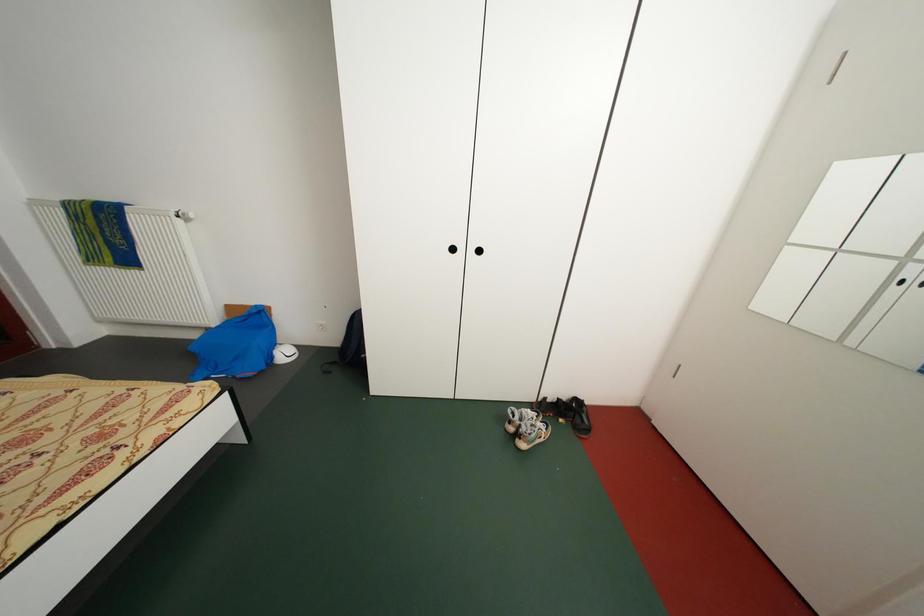
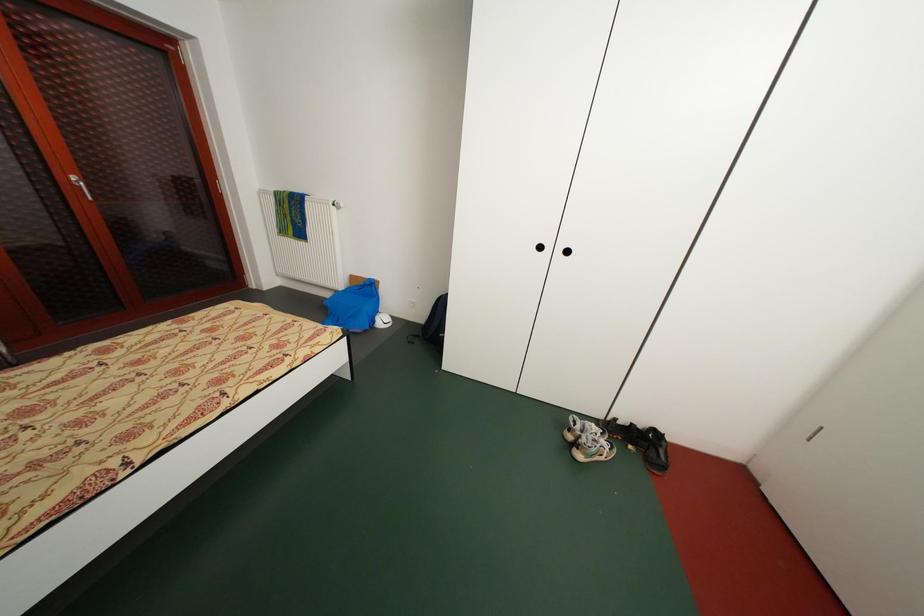
Question: Based on the continuous images, in which direction is the camera rotating? Reply with the corresponding letter.

Choices:
 (A) Left
 (B) Right
 (C) Up
 (D) Down

Answer: (A)